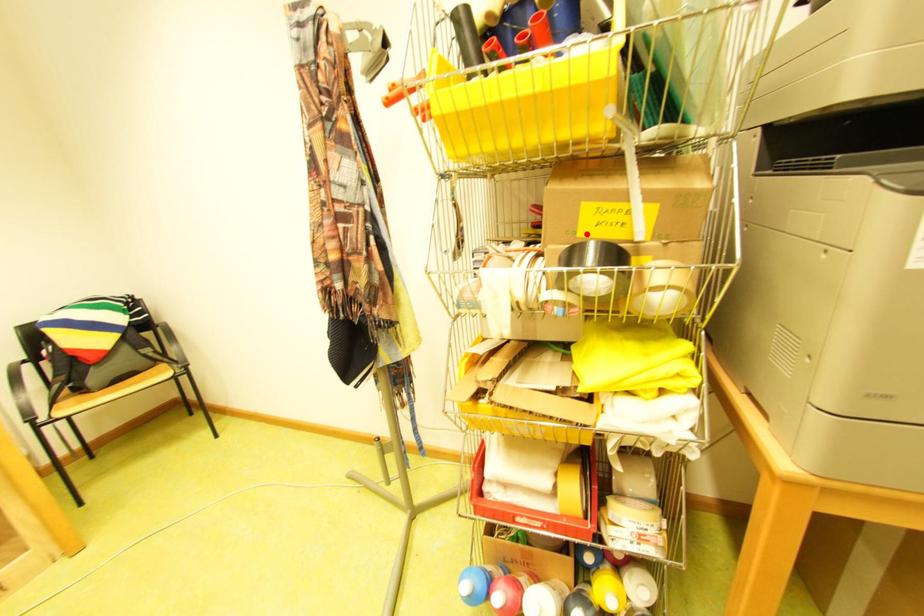
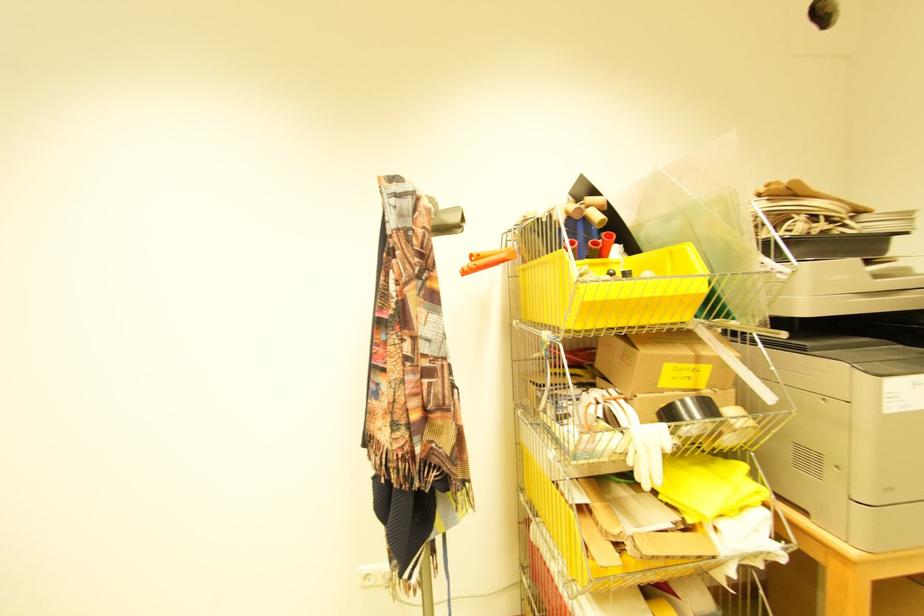
Find the pixel in the second image that matches the highlighted location in the first image.

(669, 386)